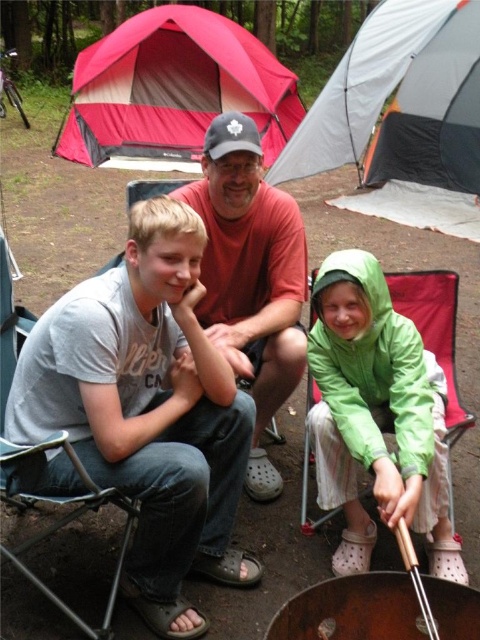
Question: Is gray fabric tent at upper center above green matte raincoat at center?

Choices:
 (A) no
 (B) yes

Answer: (B)

Question: Based on their relative distances, which object is nearer to the green matte raincoat at center?

Choices:
 (A) gray fabric tent at upper center
 (B) red/gray tent at upper left
 (C) gray cotton t-shirt at center

Answer: (C)

Question: Observing the image, what is the correct spatial positioning of gray cotton t-shirt at center in reference to gray fabric tent at upper center?

Choices:
 (A) above
 (B) below

Answer: (B)

Question: Which point appears farthest from the camera in this image?

Choices:
 (A) (388, 417)
 (B) (204, 68)
 (C) (176, 508)

Answer: (B)

Question: Which object is farther from the camera taking this photo?

Choices:
 (A) gray fabric tent at upper center
 (B) green matte raincoat at center
 (C) gray cotton t-shirt at center
 (D) red/gray tent at upper left

Answer: (D)

Question: Considering the relative positions of gray fabric tent at upper center and red/gray tent at upper left in the image provided, where is gray fabric tent at upper center located with respect to red/gray tent at upper left?

Choices:
 (A) above
 (B) below

Answer: (B)